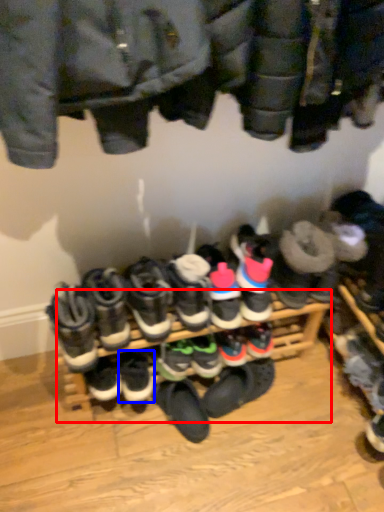
Question: Among these objects, which one is farthest to the camera, shelf (highlighted by a red box) or footwear (highlighted by a blue box)?

Choices:
 (A) shelf
 (B) footwear

Answer: (B)